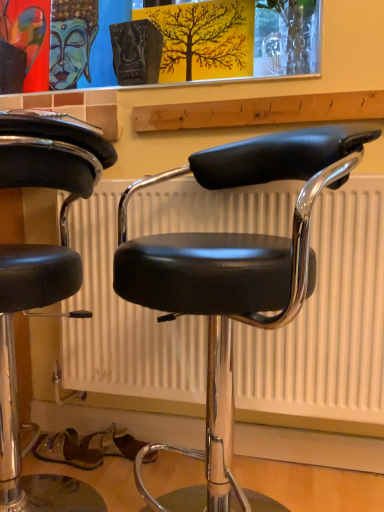
Question: Based on their positions, is black leather stool at center, the 2th chair in the right-to-left sequence, located to the left or right of black leather chair at center, the 1th chair positioned from the right?

Choices:
 (A) right
 (B) left

Answer: (B)

Question: Based on their sizes in the image, would you say black leather stool at center, the 2th chair in the right-to-left sequence, is bigger or smaller than black leather chair at center, the 1th chair positioned from the right?

Choices:
 (A) small
 (B) big

Answer: (A)

Question: In terms of width, does black leather stool at center, the 2th chair in the right-to-left sequence, look wider or thinner when compared to black leather chair at center, the 1th chair positioned from the right?

Choices:
 (A) wide
 (B) thin

Answer: (B)

Question: Is black leather chair at center, which is the 2th chair from left to right, to the left or to the right of black leather stool at center, which ranks as the first chair in left-to-right order, in the image?

Choices:
 (A) left
 (B) right

Answer: (B)

Question: From the image's perspective, is black leather chair at center, which is the 2th chair from left to right, above or below black leather stool at center, which ranks as the first chair in left-to-right order?

Choices:
 (A) above
 (B) below

Answer: (A)

Question: Considering the positions of point (211, 169) and point (91, 502), is point (211, 169) closer or farther from the camera than point (91, 502)?

Choices:
 (A) farther
 (B) closer

Answer: (B)

Question: Relative to black leather stool at center, which ranks as the first chair in left-to-right order, is black leather chair at center, which is the 2th chair from left to right, in front or behind?

Choices:
 (A) front
 (B) behind

Answer: (A)